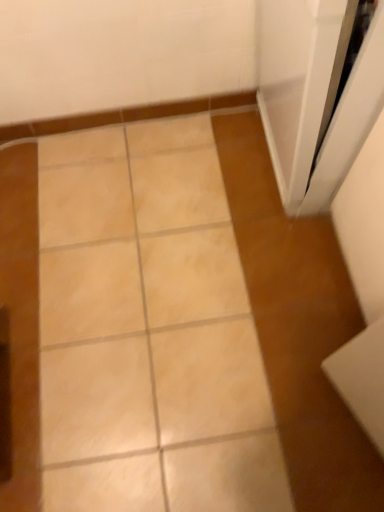
Question: Is white glossy screen door at upper right taller or shorter than beige glossy tile at center?

Choices:
 (A) short
 (B) tall

Answer: (B)

Question: Is white glossy screen door at upper right inside the boundaries of beige glossy tile at center, or outside?

Choices:
 (A) inside
 (B) outside

Answer: (B)

Question: Is white glossy screen door at upper right bigger or smaller than beige glossy tile at center?

Choices:
 (A) small
 (B) big

Answer: (B)

Question: Is point (157, 135) positioned closer to the camera than point (360, 79)?

Choices:
 (A) farther
 (B) closer

Answer: (A)

Question: Looking at the image, does beige glossy tile at center seem bigger or smaller compared to white glossy screen door at upper right?

Choices:
 (A) big
 (B) small

Answer: (B)

Question: Based on their positions, is beige glossy tile at center located to the left or right of white glossy screen door at upper right?

Choices:
 (A) left
 (B) right

Answer: (A)

Question: In terms of width, does beige glossy tile at center look wider or thinner when compared to white glossy screen door at upper right?

Choices:
 (A) wide
 (B) thin

Answer: (A)